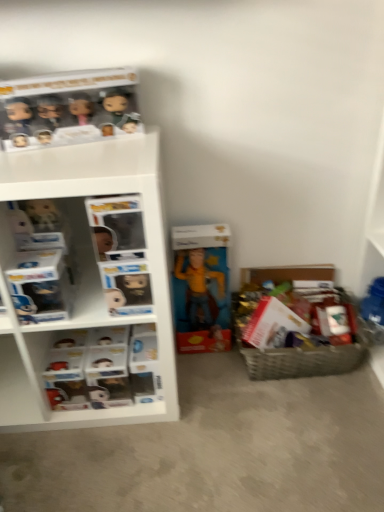
The width and height of the screenshot is (384, 512). I want to click on free space in front of white plastic shelf at left, so click(x=92, y=464).